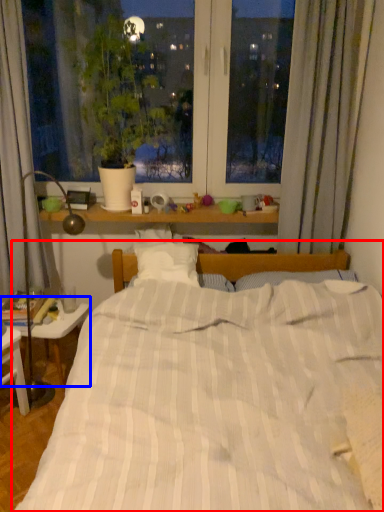
Question: Which of the following is the closest to the observer, bed (highlighted by a red box) or table (highlighted by a blue box)?

Choices:
 (A) bed
 (B) table

Answer: (A)